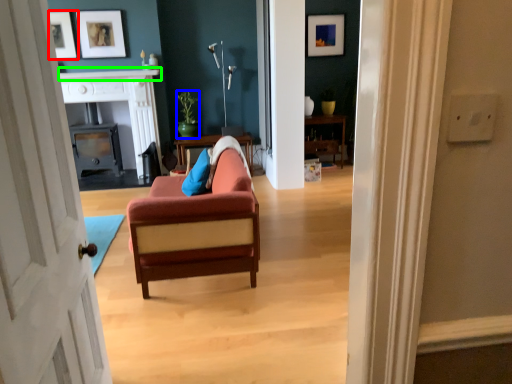
Question: Which is farther away from picture frame (highlighted by a red box)? houseplant (highlighted by a blue box) or mantle (highlighted by a green box)?

Choices:
 (A) houseplant
 (B) mantle

Answer: (A)